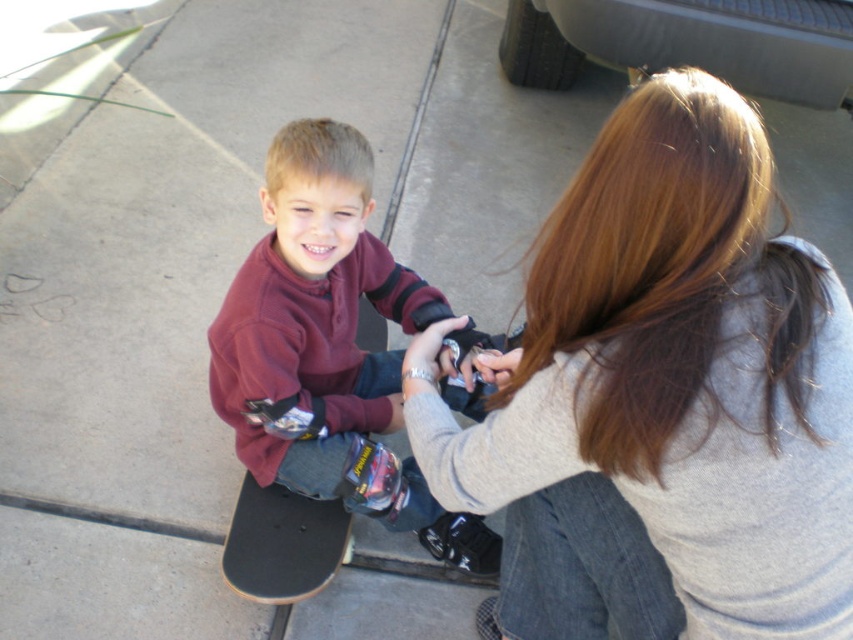
You are a fashion designer analyzing clothing thickness for a new line. You observe two garments in the image, the smooth gray sweater at center and the maroon fleece shirt at center. Which garment would you recommend for a winter collection if thickness is a priority?

The maroon fleece shirt at center is thicker than the smooth gray sweater at center, so it would be more suitable for a winter collection due to its added warmth and insulation.

You are a skateboarder who wants to choose between the smooth concrete skateboard at center and the black smooth skateboard at center for a trick that requires a larger board. Which one should you pick?

You should choose the smooth concrete skateboard at center because it is larger in size than the black smooth skateboard at center, making it more suitable for the trick.

You are a clothing designer analyzing the image. Which item of clothing has a larger size between the smooth gray sweater at center and the maroon fleece shirt at center?

The smooth gray sweater at center has a larger size compared to the maroon fleece shirt at center.